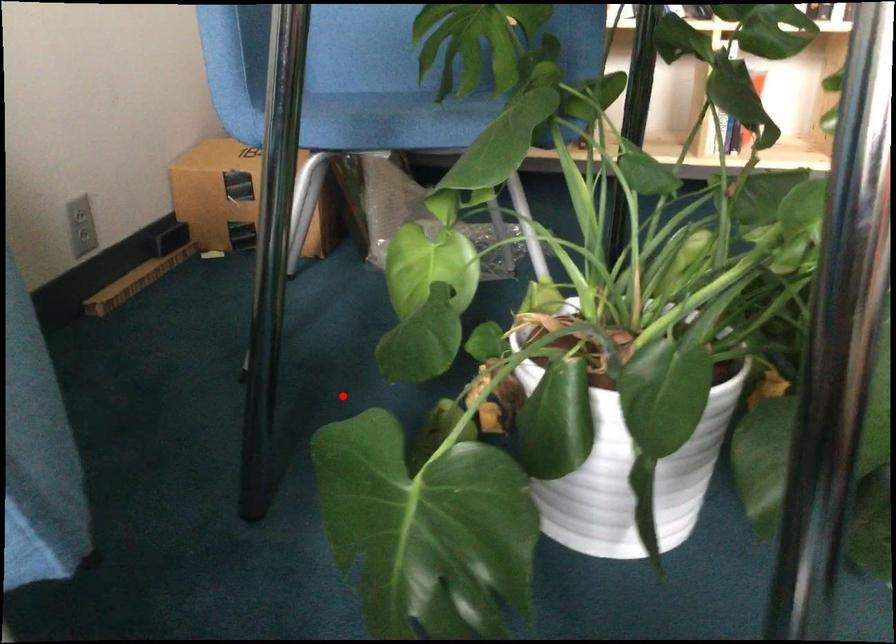
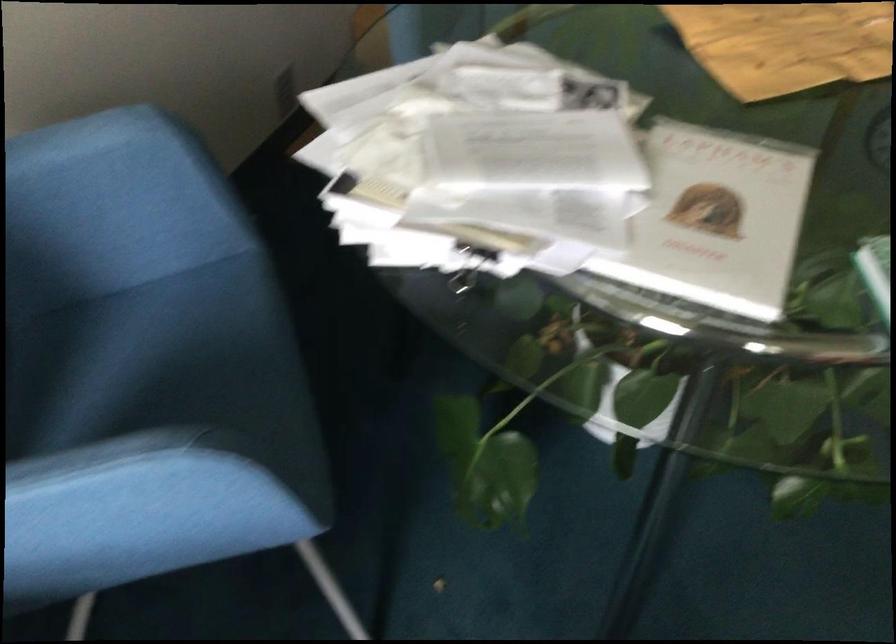
Question: A red point is marked in image1. In image2, is the corresponding 3D point closer to the camera or farther? Reply with the corresponding letter.

Choices:
 (A) The corresponding 3D point is closer.
 (B) The corresponding 3D point is farther.

Answer: (B)